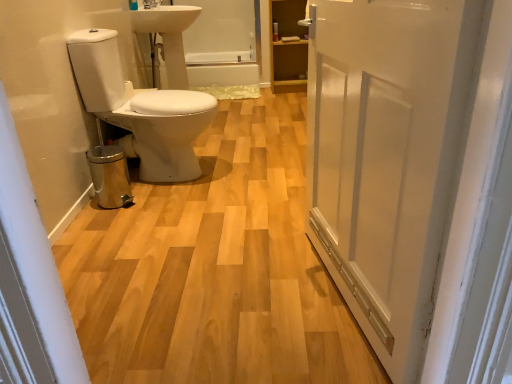
Question: From their relative heights in the image, would you say white matte door at center is taller or shorter than glossy ceramic tap at upper center?

Choices:
 (A) short
 (B) tall

Answer: (B)

Question: Looking at the image, does white matte door at center seem bigger or smaller compared to glossy ceramic tap at upper center?

Choices:
 (A) big
 (B) small

Answer: (A)

Question: Which is farther from the white glossy bathtub at center?

Choices:
 (A) glossy ceramic tap at upper center
 (B) white matte door at center
 (C) wooden cabinet at upper right
 (D) white glossy toilet at left
 (E) white glossy sink at upper center

Answer: (B)

Question: Considering the real-world distances, which object is closest to the wooden cabinet at upper right?

Choices:
 (A) white glossy toilet at left
 (B) white glossy toilet at left
 (C) white matte door at center
 (D) white glossy sink at upper center
 (E) white glossy bathtub at center

Answer: (E)